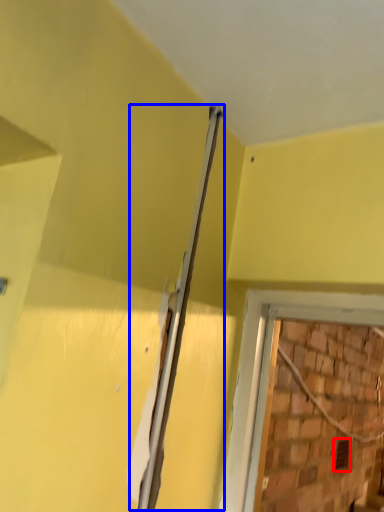
Question: Among these objects, which one is nearest to the camera, hole (highlighted by a red box) or beam (highlighted by a blue box)?

Choices:
 (A) hole
 (B) beam

Answer: (B)